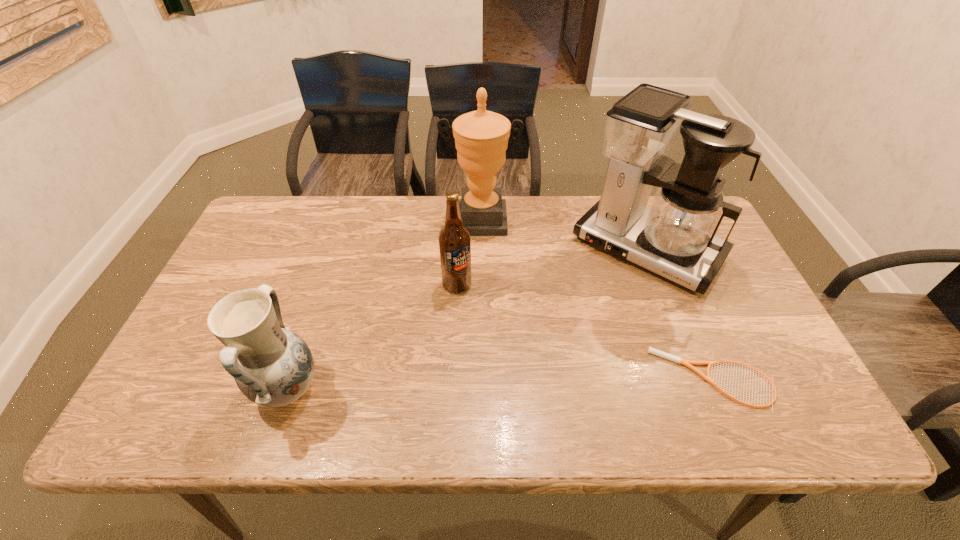
You are a GUI agent. You are given a task and a screenshot of the screen. Output one action in this format:
    pyautogui.click(x=<x>, y=<y>)
    Task: Click on the vacant space on the desktop that is between the leftmost object and the shortest object and is positioned at the front of the award with handles
    The image size is (960, 540).
    Given the screenshot: What is the action you would take?
    pyautogui.click(x=482, y=385)

This screenshot has height=540, width=960. Find the location of `vacant spot on the desktop that is between the pottery and the tennis racket and is positioned on the label of the beer bottle`. vacant spot on the desktop that is between the pottery and the tennis racket and is positioned on the label of the beer bottle is located at coordinates (509, 384).

Image resolution: width=960 pixels, height=540 pixels. What are the coordinates of `vacant spot on the desktop that is between the pottery and the tennis racket and is positioned at the front of the coffee maker where the controls are located` in the screenshot? It's located at pos(539,384).